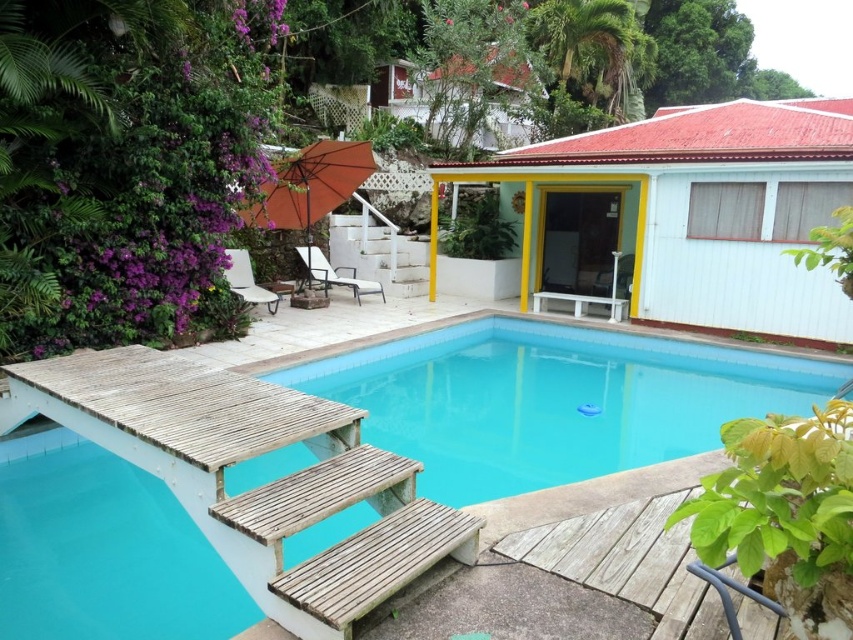
Question: Which point is farther to the camera?

Choices:
 (A) orange fabric umbrella at upper center
 (B) smooth concrete pool at center
 (C) matte white plastic chair at center
 (D) white wood picnic table at center

Answer: (C)

Question: Which object appears farthest from the camera in this image?

Choices:
 (A) white fabric chaise lounge at center
 (B) orange fabric umbrella at upper center
 (C) white wood picnic table at center
 (D) smooth concrete pool at center

Answer: (A)

Question: Which of the following is the closest to the observer?

Choices:
 (A) orange fabric umbrella at upper center
 (B) matte white plastic chair at center
 (C) smooth concrete pool at center
 (D) white wood picnic table at center

Answer: (C)

Question: Is white plastic chair at upper left to the right of white wood picnic table at center from the viewer's perspective?

Choices:
 (A) no
 (B) yes

Answer: (A)

Question: Does smooth concrete pool at center have a greater width compared to orange fabric umbrella at upper center?

Choices:
 (A) yes
 (B) no

Answer: (A)

Question: Can you confirm if smooth concrete pool at center is positioned below white plastic chair at upper left?

Choices:
 (A) yes
 (B) no

Answer: (A)